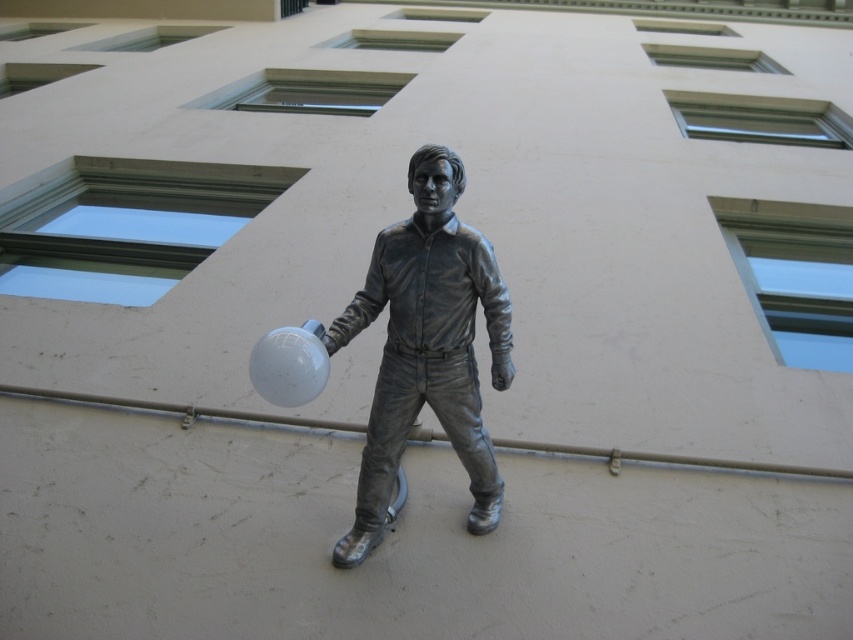
Question: Is shiny bronze figure at center closer to the viewer compared to white glossy balloon at center?

Choices:
 (A) no
 (B) yes

Answer: (A)

Question: Which of the following is the farthest from the observer?

Choices:
 (A) white glossy balloon at center
 (B) shiny bronze figure at center

Answer: (B)

Question: Does shiny bronze figure at center have a larger size compared to white glossy balloon at center?

Choices:
 (A) yes
 (B) no

Answer: (A)

Question: Does shiny bronze figure at center appear over white glossy balloon at center?

Choices:
 (A) yes
 (B) no

Answer: (B)